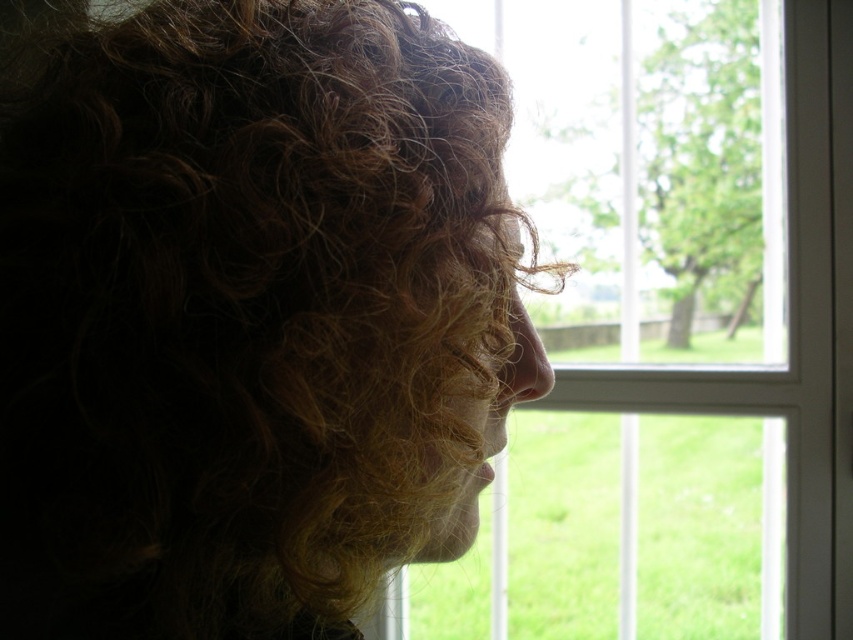
You are an interior designer assessing the space. You notice the curly golden hair at right and the clear glass window at center. Which object takes up more visual space in the image?

The clear glass window at center takes up more visual space than the curly golden hair at right because the curly golden hair at right occupies less space than clear glass window at center.

You are an interior designer assessing the space. You need to determine if the curly golden hair at right can fit entirely within the clear glass window at center without any part being cut off. Based on their widths, can it fit?

The curly golden hair at right has a lesser width compared to the clear glass window at center, so it can fit entirely within the window without being cut off.